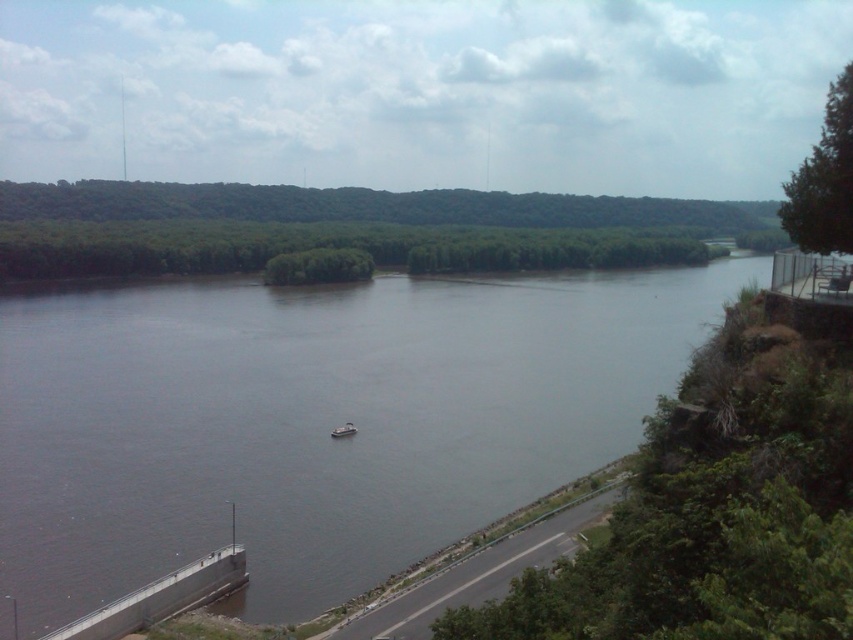
Does brown water at center come behind white plastic boat at center?

No, brown water at center is in front of white plastic boat at center.

At what (x,y) coordinates should I click in order to perform the action: click on brown water at center. Please return your answer as a coordinate pair (x, y). The width and height of the screenshot is (853, 640). Looking at the image, I should click on (314, 420).

Does point (135, 456) lie in front of point (350, 420)?

That is True.

You are a GUI agent. You are given a task and a screenshot of the screen. Output one action in this format:
    pyautogui.click(x=<x>, y=<y>)
    Task: Click on the brown water at center
    
    Given the screenshot: What is the action you would take?
    pyautogui.click(x=314, y=420)